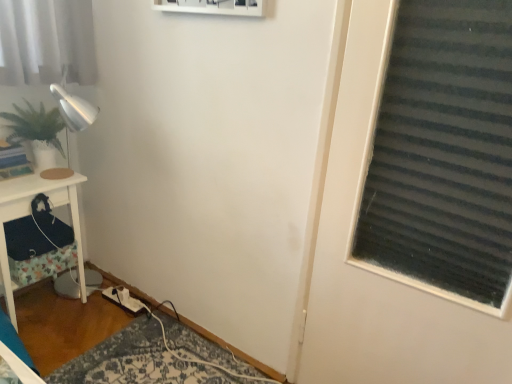
What are the coordinates of `free space to the left of white fabric extension cord at lower left` in the screenshot? It's located at (92, 304).